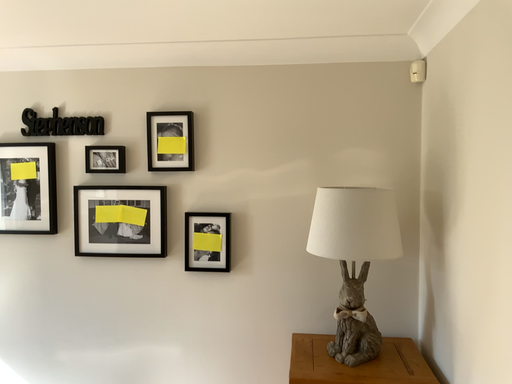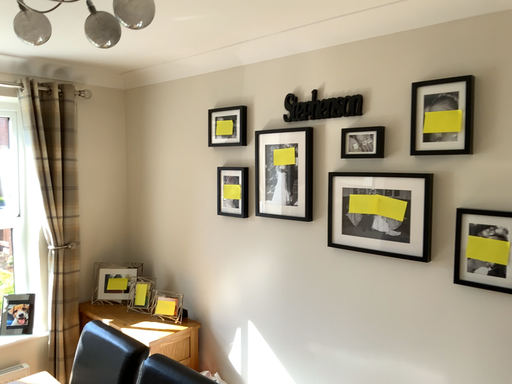
Question: How did the camera likely rotate when shooting the video?

Choices:
 (A) rotated left
 (B) rotated right

Answer: (A)